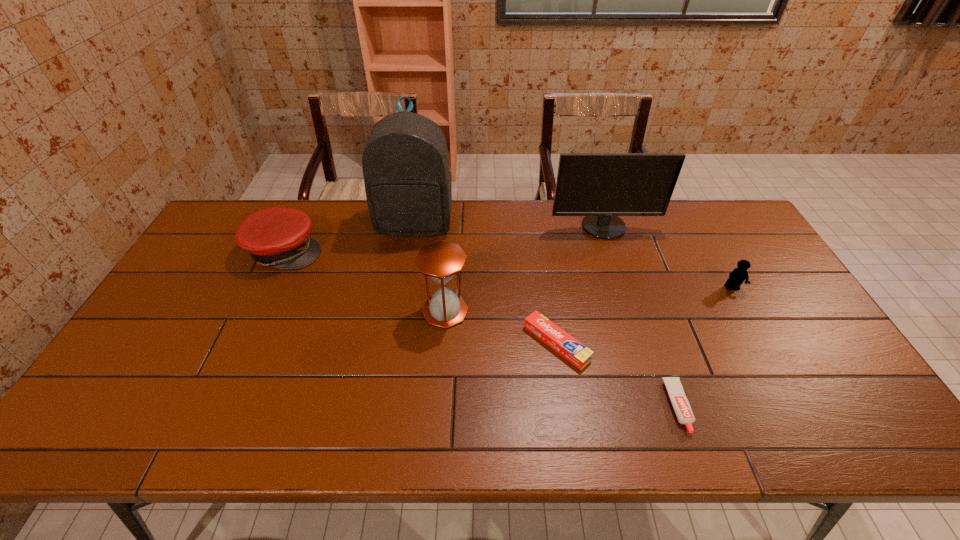
At what (x,y) coordinates should I click in order to perform the action: click on vacant space located 0.330m on the screen side of the second tallest object. Please return your answer as a coordinate pair (x, y). Looking at the image, I should click on (633, 318).

This screenshot has width=960, height=540. Identify the location of vacant space located 0.090m on the back of the hourglass. (448, 273).

The height and width of the screenshot is (540, 960). I want to click on vacant space located on the front of the leftmost object with an emblem, so click(x=443, y=251).

Where is `free point located 0.070m on the front-facing side of the fourth farthest object`? The height and width of the screenshot is (540, 960). free point located 0.070m on the front-facing side of the fourth farthest object is located at coordinates (745, 312).

This screenshot has height=540, width=960. Find the location of `free region located 0.120m on the back of the left toothpaste`. free region located 0.120m on the back of the left toothpaste is located at coordinates (548, 287).

Locate an element on the screen. This screenshot has height=540, width=960. vacant space located on the back of the nearest object is located at coordinates (639, 296).

Identify the location of backpack located in the far edge section of the desktop. (406, 170).

Locate an element on the screen. This screenshot has width=960, height=540. monitor at the far edge is located at coordinates (600, 186).

Find the location of a particular element. Image resolution: width=960 pixels, height=540 pixels. cap that is at the far edge is located at coordinates (278, 237).

This screenshot has height=540, width=960. Identify the location of object situated at the near edge. (680, 403).